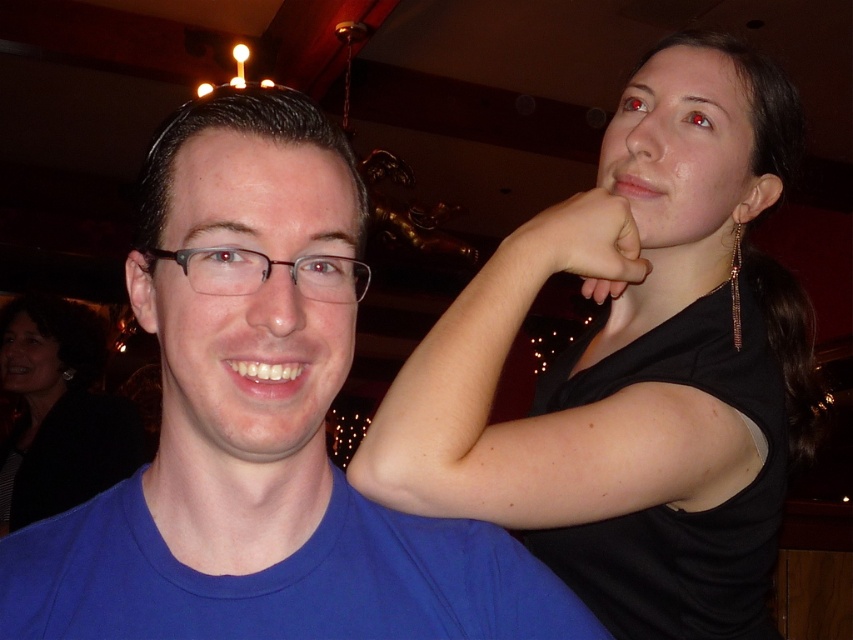
Is black matte shirt at upper right positioned behind blue matte shirt at center?

Yes, black matte shirt at upper right is behind blue matte shirt at center.

Which is behind, point (465, 460) or point (61, 572)?

Positioned behind is point (465, 460).

The height and width of the screenshot is (640, 853). I want to click on black matte shirt at upper right, so click(x=633, y=364).

What do you see at coordinates (260, 433) in the screenshot?
I see `blue matte shirt at center` at bounding box center [260, 433].

Is blue matte shirt at center further to camera compared to matte skin hand at upper right?

No, blue matte shirt at center is closer to the viewer.

Locate an element on the screen. blue matte shirt at center is located at coordinates (260, 433).

Is point (583, 227) closer to viewer compared to point (337, 266)?

No, (583, 227) is behind (337, 266).

Identify the location of matte skin hand at upper right. This screenshot has width=853, height=640. (567, 250).